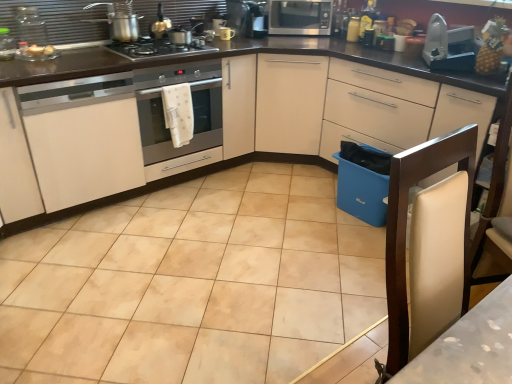
Where is `free location to the left of yellow textured pineapple at upper right`? This screenshot has width=512, height=384. free location to the left of yellow textured pineapple at upper right is located at coordinates (459, 74).